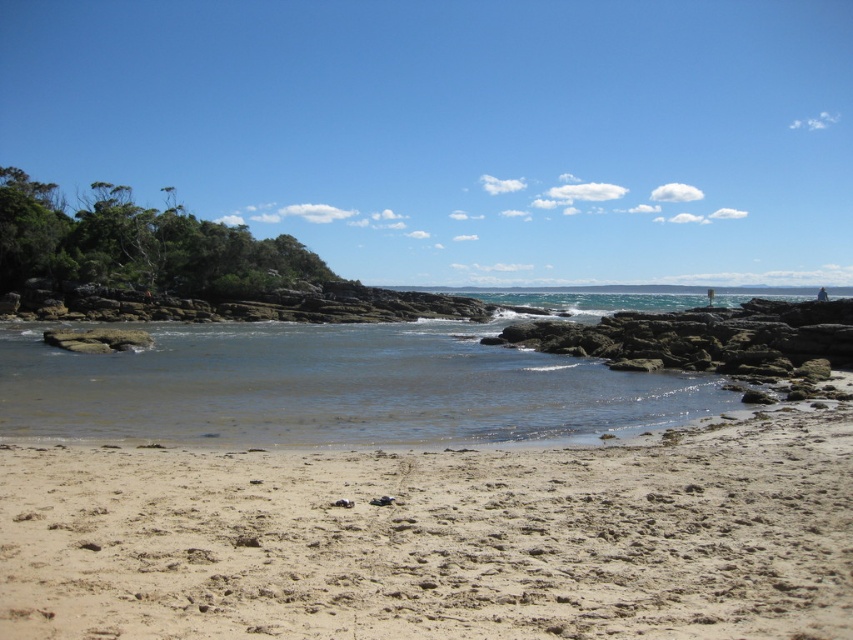
Question: Among these points, which one is farthest from the camera?

Choices:
 (A) (479, 397)
 (B) (94, 556)

Answer: (A)

Question: Is light brown sandy beach at lower center thinner than clear water at center?

Choices:
 (A) yes
 (B) no

Answer: (A)

Question: Which of the following is the closest to the observer?

Choices:
 (A) (323, 429)
 (B) (590, 468)

Answer: (B)

Question: Can you confirm if light brown sandy beach at lower center is positioned to the right of clear water at center?

Choices:
 (A) yes
 (B) no

Answer: (A)

Question: Does light brown sandy beach at lower center have a larger size compared to clear water at center?

Choices:
 (A) no
 (B) yes

Answer: (A)

Question: Among these objects, which one is farthest from the camera?

Choices:
 (A) clear water at center
 (B) light brown sandy beach at lower center

Answer: (A)